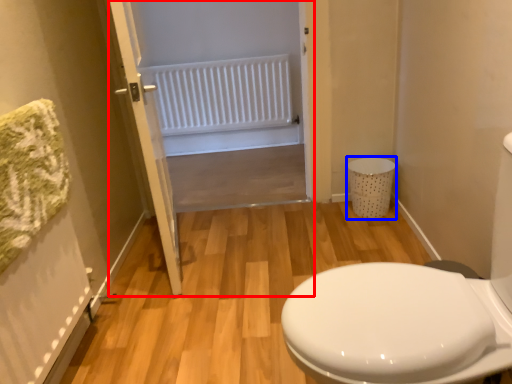
Question: Which point is closer to the camera, screen door (highlighted by a red box) or laundry basket (highlighted by a blue box)?

Choices:
 (A) screen door
 (B) laundry basket

Answer: (A)